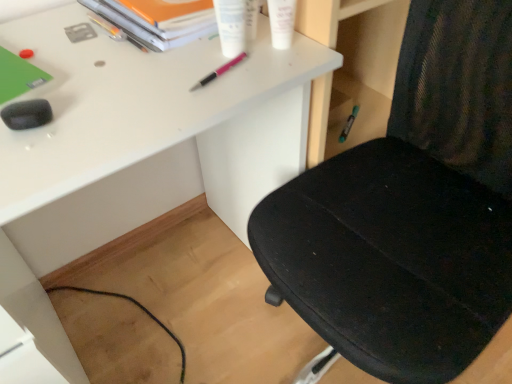
The image size is (512, 384). In order to click on free space in front of metallic silver pen at upper left, which is the 5th stationery in right-to-left order in this screenshot , I will do `click(90, 66)`.